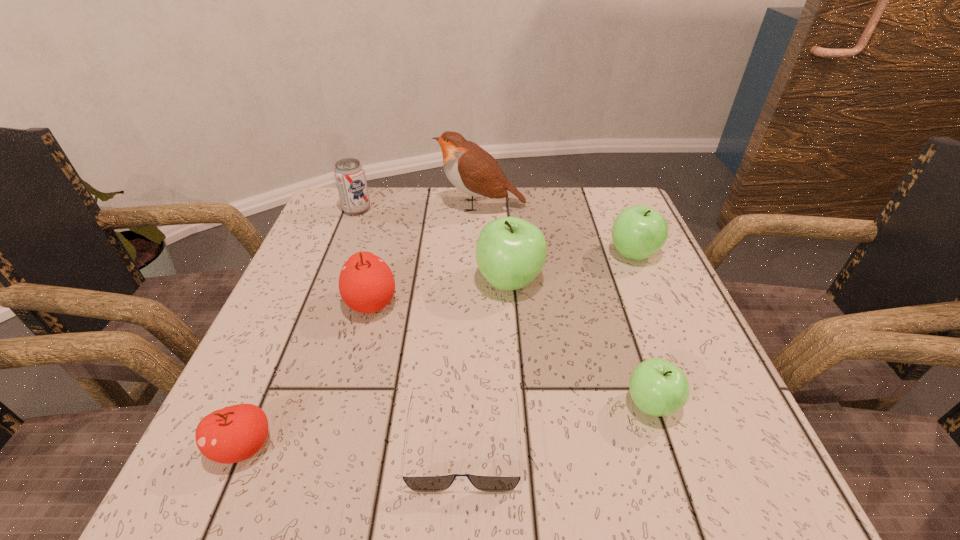
Identify which apple is located as the nearest to the beer can. Please provide its 2D coordinates. Your answer should be formatted as a tuple, i.e. [(x, y)], where the tuple contains the x and y coordinates of a point satisfying the conditions above.

[(366, 283)]

Locate which green apple ranks second in proximity to the smallest green apple. Please provide its 2D coordinates. Your answer should be formatted as a tuple, i.e. [(x, y)], where the tuple contains the x and y coordinates of a point satisfying the conditions above.

[(638, 232)]

The image size is (960, 540). I want to click on green apple object that ranks as the second closest to the second smallest green apple, so click(657, 387).

At what (x,y) coordinates should I click in order to perform the action: click on vacant space that satisfies the following two spatial constraints: 1. at the face of the tallest object; 2. on the right side of the second tallest object. Please return your answer as a coordinate pair (x, y). Image resolution: width=960 pixels, height=540 pixels. Looking at the image, I should click on (481, 281).

Identify the location of vacant space that satisfies the following two spatial constraints: 1. on the front side of the farther red apple; 2. on the left side of the nearest green apple. (345, 404).

Where is `free space that satisfies the following two spatial constraints: 1. at the face of the third apple from right to left; 2. on the left side of the brown bird`? The width and height of the screenshot is (960, 540). free space that satisfies the following two spatial constraints: 1. at the face of the third apple from right to left; 2. on the left side of the brown bird is located at coordinates (481, 281).

I want to click on vacant space that satisfies the following two spatial constraints: 1. on the front side of the nearest green apple; 2. on the right side of the fourth apple from right to left, so click(345, 404).

Identify the location of vacant space that satisfies the following two spatial constraints: 1. at the face of the second smallest green apple; 2. on the left side of the bird. (481, 254).

Identify the location of blank space that satisfies the following two spatial constraints: 1. on the front side of the smallest green apple; 2. on the left side of the beer can. The width and height of the screenshot is (960, 540). (281, 404).